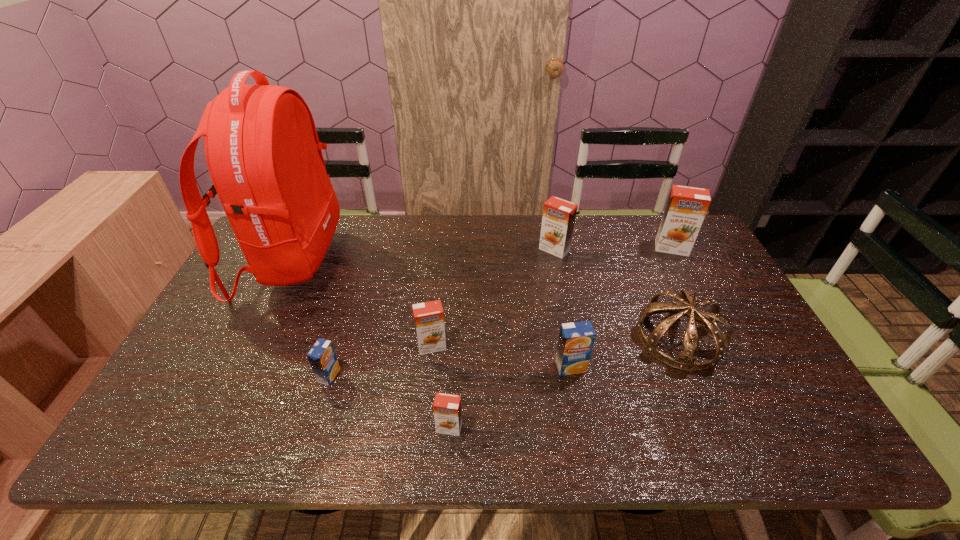
Locate an element on the screen. The height and width of the screenshot is (540, 960). vacant space that satisfies the following two spatial constraints: 1. on the main compartment of the backpack; 2. on the right side of the brown tiara is located at coordinates (253, 338).

Find the location of `free region that satisfies the following two spatial constraints: 1. on the front side of the seventh shortest object; 2. on the main compartment of the tallest object`. free region that satisfies the following two spatial constraints: 1. on the front side of the seventh shortest object; 2. on the main compartment of the tallest object is located at coordinates (679, 261).

Find the location of a particular element. free region that satisfies the following two spatial constraints: 1. on the main compartment of the red backpack; 2. on the right side of the leftmost orange juice is located at coordinates (235, 375).

This screenshot has width=960, height=540. In order to click on vacant space that satisfies the following two spatial constraints: 1. on the back side of the tiara; 2. on the main compartment of the leftmost object in this screenshot , I will do `click(646, 261)`.

Find the location of a particular element. The height and width of the screenshot is (540, 960). blank area in the image that satisfies the following two spatial constraints: 1. on the back side of the biggest orange orange juice; 2. on the right side of the bigger blue orange_juice is located at coordinates (548, 248).